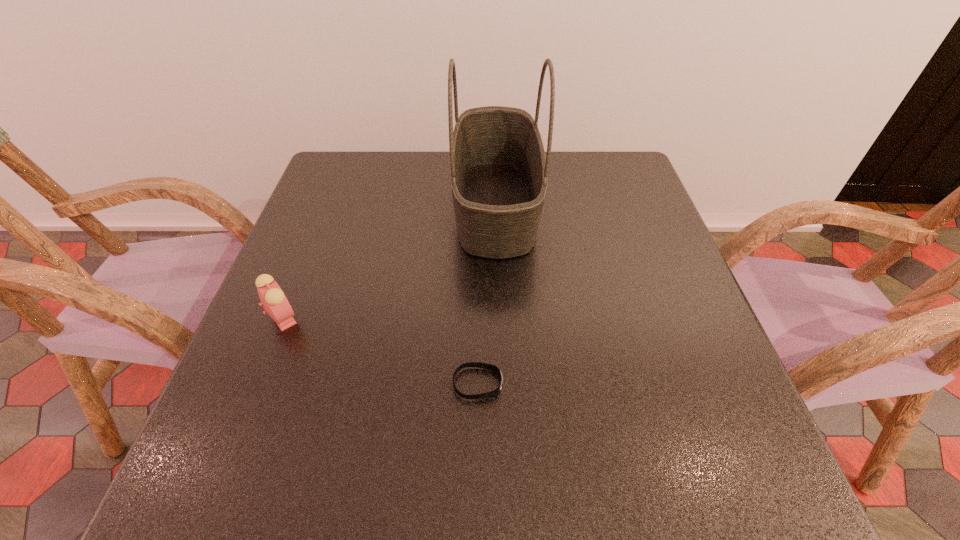
Locate an element on the screen. The height and width of the screenshot is (540, 960). the farthest object is located at coordinates (498, 170).

At what (x,y) coordinates should I click in order to perform the action: click on basket. Please return your answer as a coordinate pair (x, y). Looking at the image, I should click on (498, 170).

The width and height of the screenshot is (960, 540). In order to click on the leftmost object in this screenshot , I will do `click(274, 301)`.

This screenshot has height=540, width=960. In order to click on alarm clock in this screenshot , I will do `click(274, 301)`.

At what (x,y) coordinates should I click in order to perform the action: click on the nearest object. Please return your answer as a coordinate pair (x, y). This screenshot has width=960, height=540. Looking at the image, I should click on (491, 367).

The width and height of the screenshot is (960, 540). What are the coordinates of `wristband` in the screenshot? It's located at (491, 367).

Locate an element on the screen. The height and width of the screenshot is (540, 960). free space located 0.230m on the front of the basket is located at coordinates (502, 355).

This screenshot has width=960, height=540. In order to click on free space located 0.310m on the face of the leftmost object in this screenshot , I will do `click(458, 318)`.

This screenshot has height=540, width=960. I want to click on free location located on the display of the wristband, so [x=719, y=383].

Identify the location of object that is at the far edge. (498, 170).